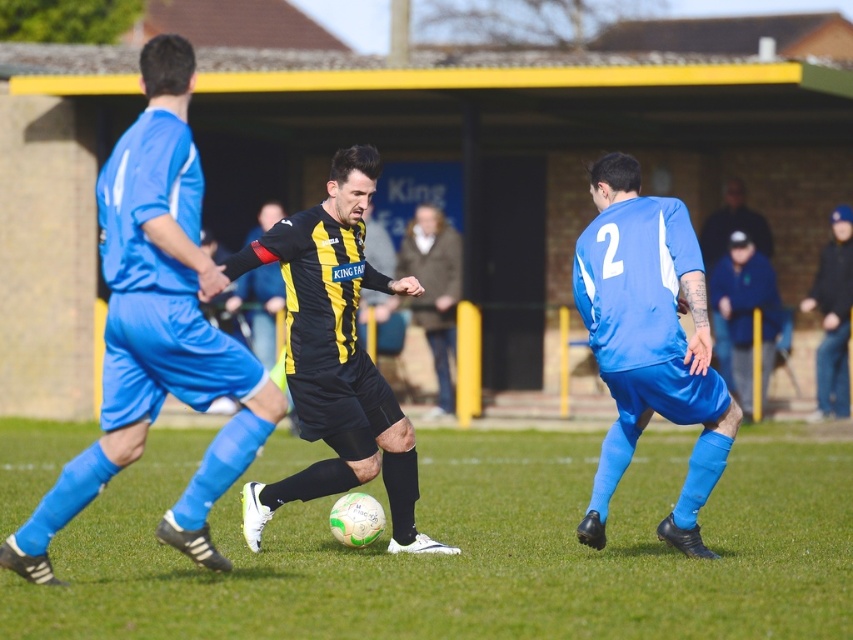
Does green grass at center have a smaller size compared to blue fabric jacket at right?

No, green grass at center is not smaller than blue fabric jacket at right.

Identify the location of green grass at center. This screenshot has height=640, width=853. (469, 548).

You are a GUI agent. You are given a task and a screenshot of the screen. Output one action in this format:
    pyautogui.click(x=<x>, y=<y>)
    Task: Click on the green grass at center
    This screenshot has width=853, height=640.
    Given the screenshot: What is the action you would take?
    pyautogui.click(x=469, y=548)

Is black matte jersey at center to the right of blue matte jersey at right from the viewer's perspective?

Incorrect, black matte jersey at center is not on the right side of blue matte jersey at right.

This screenshot has height=640, width=853. What do you see at coordinates (157, 326) in the screenshot? I see `black matte jersey at center` at bounding box center [157, 326].

Locate an element on the screen. The height and width of the screenshot is (640, 853). black matte jersey at center is located at coordinates (157, 326).

This screenshot has height=640, width=853. I want to click on green grass at center, so click(469, 548).

How far apart are green grass at center and dark blue jeans at right?

The distance of green grass at center from dark blue jeans at right is 5.15 meters.

Between point (387, 563) and point (836, 417), which one is positioned behind?

The point (836, 417) is more distant.

At what (x,y) coordinates should I click in order to perform the action: click on green grass at center. Please return your answer as a coordinate pair (x, y). This screenshot has height=640, width=853. Looking at the image, I should click on click(x=469, y=548).